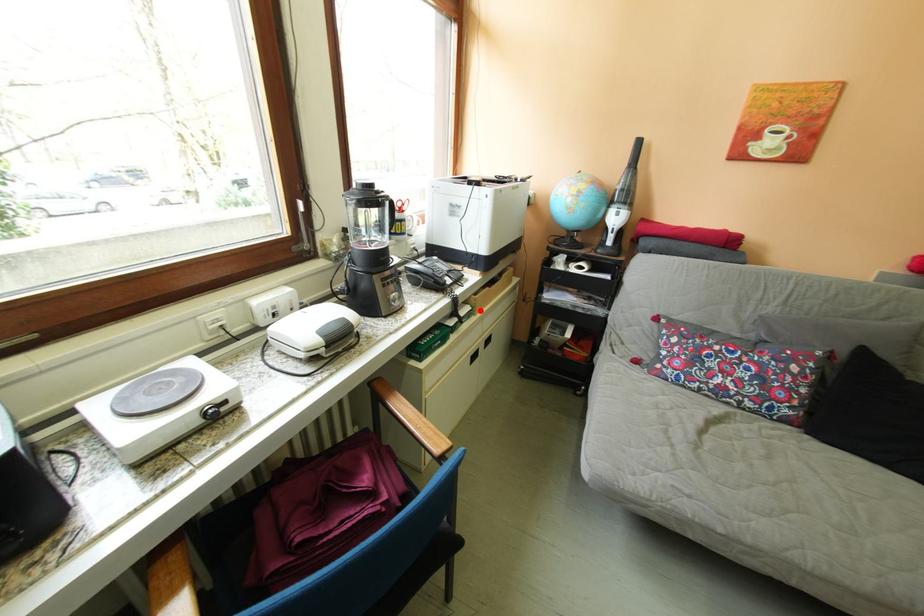
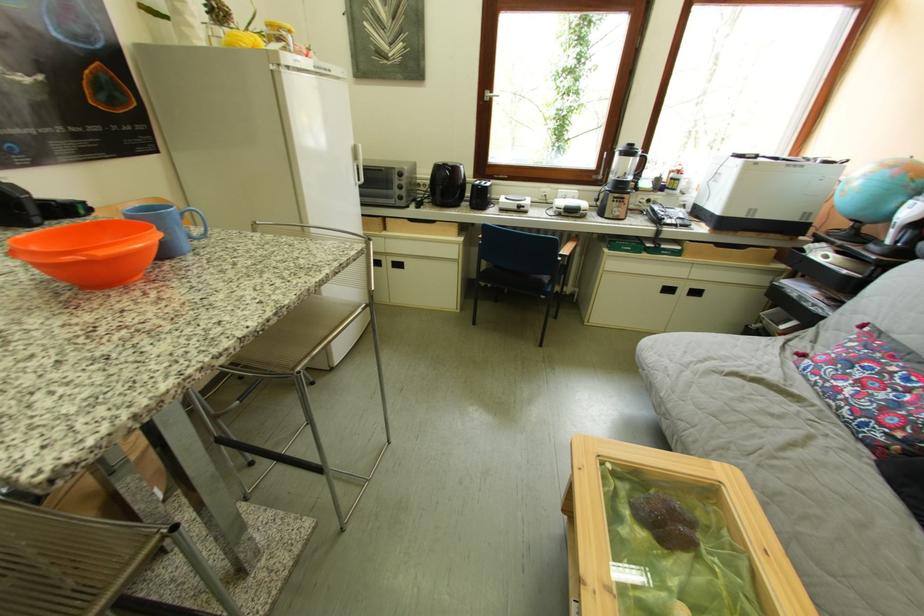
The point at the highlighted location is marked in the first image. Where is the corresponding point in the second image?

(690, 251)